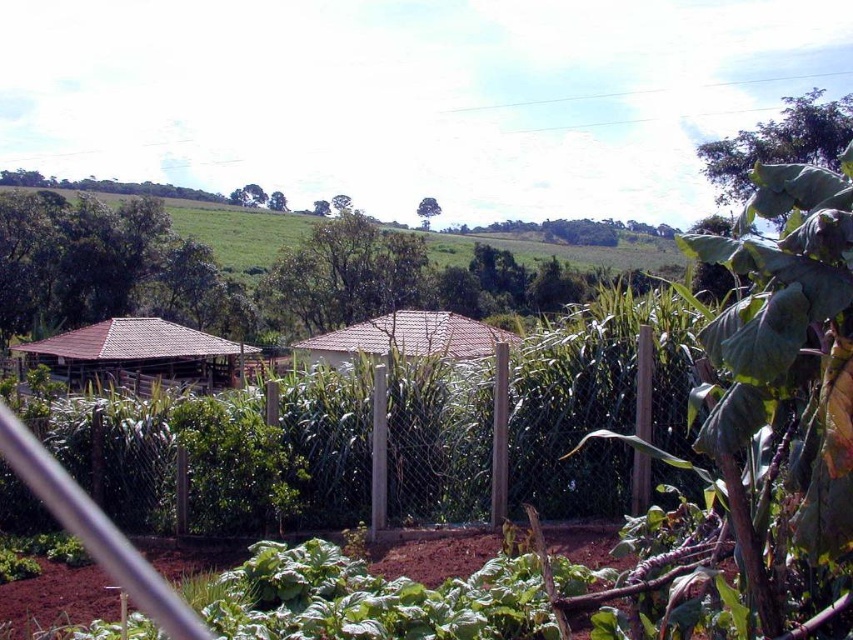
You are planning to install a new fence post in the garden. The wooden fence at center is currently smaller than the brown tile hut at center. Which object should you avoid placing the post near to ensure it doesn not block the view of the larger structure?

You should avoid placing the post near the brown tile hut at center because it is larger than the wooden fence at center, so blocking its view would be more impactful.

You are planning to place a 3 meter wide garden bench in the fenced garden area. The wooden fence at center and the brown wooden hut at left are in the way. Which object has a smaller width and can be moved to make space for the bench?

The wooden fence at center has a smaller width than the brown wooden hut at left, so you can move the wooden fence at center to make space for the bench.